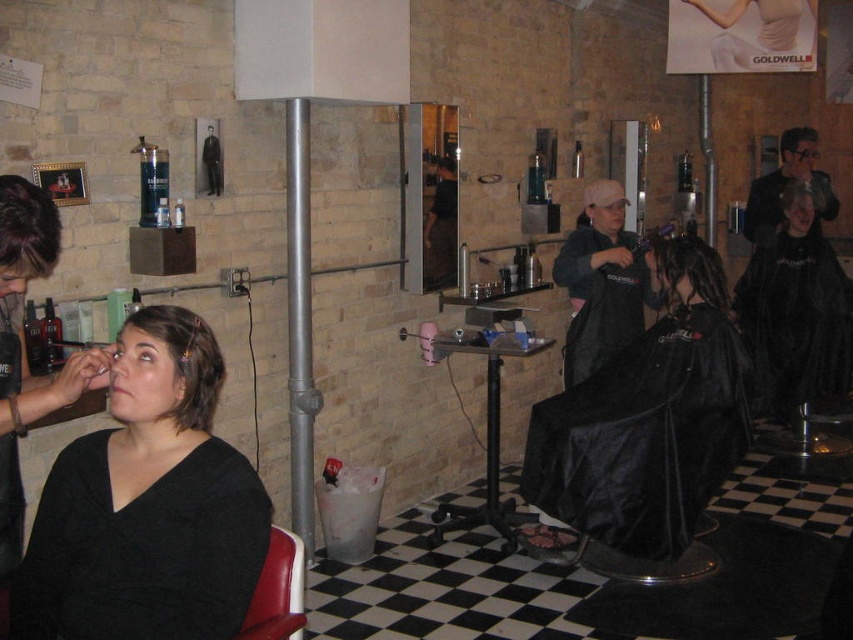
You are a customer entering the salon and see two clients with hair colors black matte hair at center and dark brown hair at upper left. Which client is positioned closer to the right side of the salon?

The black matte hair at center is positioned to the right of dark brown hair at upper left, so the client with black matte hair at center is closer to the right side of the salon.

You are a stylist in the salon and need to reach a product placed between the black matte hair at center and the dark brown hair at upper left. The product requires a minimum of 2 meters of space to safely retrieve it. Can you safely access the product?

The distance between the black matte hair at center and the dark brown hair at upper left is 2.33 meters, which exceeds the required 2 meters. Therefore, you can safely access the product.

In the hair salon scene, you notice the brown matte hair at left and the red leather chair at lower left. Which object takes up more space in the image?

The brown matte hair at left takes up more space in the image as it has a larger size compared to the red leather chair at lower left.